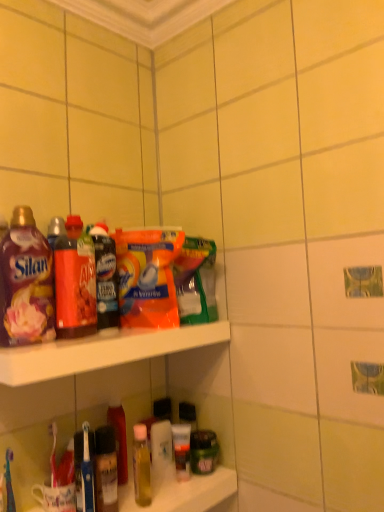
Locate an element on the screen. The height and width of the screenshot is (512, 384). vacant area that lies to the right of matte plastic bottle at upper left is located at coordinates (158, 327).